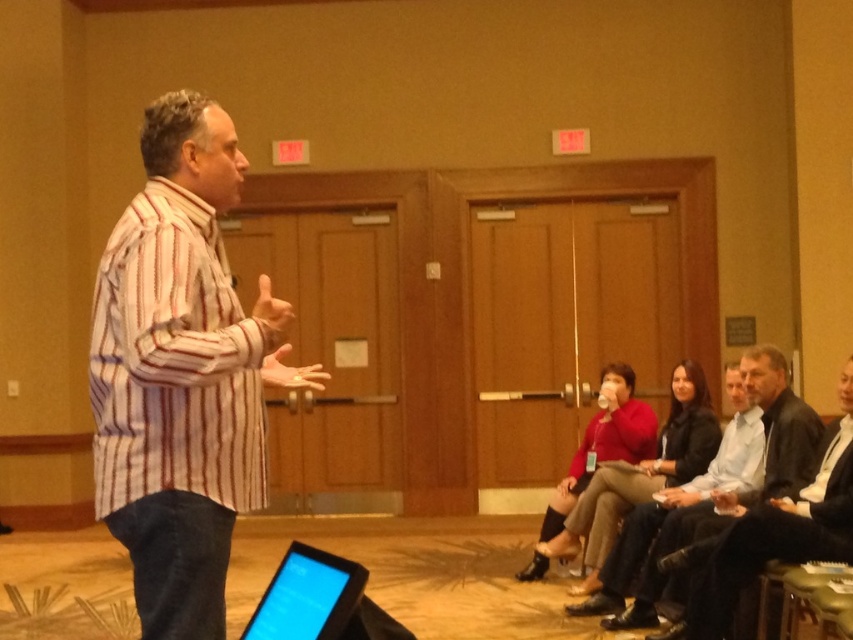
Measure the distance between dark gray leather jacket at lower right and camera.

dark gray leather jacket at lower right and camera are 14.80 feet apart from each other.

Based on the photo, between dark gray leather jacket at lower right and black glossy laptop at lower left, which one is positioned lower?

dark gray leather jacket at lower right

Is point (759, 563) more distant than point (299, 548)?

That is True.

I want to click on dark gray leather jacket at lower right, so click(x=770, y=532).

Does black glossy laptop at lower left have a greater height compared to red matte sweater at center?

Incorrect, black glossy laptop at lower left's height is not larger of red matte sweater at center's.

Which is in front, point (357, 593) or point (635, 408)?

Point (357, 593) is more forward.

This screenshot has width=853, height=640. What are the coordinates of `black glossy laptop at lower left` in the screenshot? It's located at (306, 596).

At what (x,y) coordinates should I click in order to perform the action: click on dark gray leather jacket at lower right. Please return your answer as a coordinate pair (x, y). Looking at the image, I should click on (770, 532).

Is dark gray leather jacket at lower right wider than red matte sweater at center?

Yes.

Locate an element on the screen. The width and height of the screenshot is (853, 640). dark gray leather jacket at lower right is located at coordinates (770, 532).

The image size is (853, 640). I want to click on dark gray leather jacket at lower right, so click(770, 532).